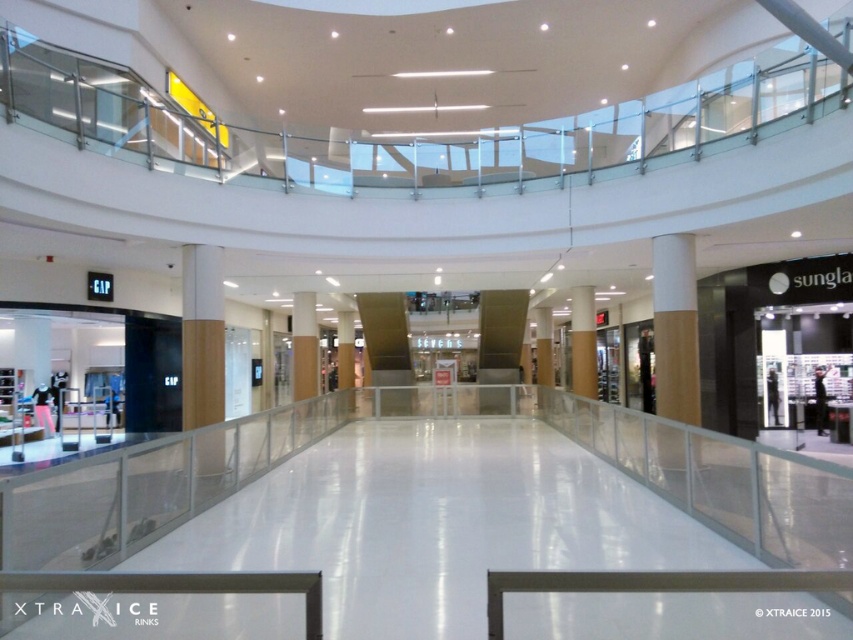
You are an interior designer assessing the mall layout. You notice the brown polished pillar at center and the smooth beige pillar at center. Which pillar would cast a longer shadow during midday if the sun is directly overhead?

The brown polished pillar at center is taller than the smooth beige pillar at center, so it would cast a longer shadow during midday when the sun is directly overhead.

You are a maintenance worker checking the pillars in the mall. You notice two pillars at the center area labeled as wooden pillar at center and brown wood pillar at center. Which one has a larger diameter?

The wooden pillar at center might be wider than brown wood pillar at center, so the wooden pillar at center likely has a larger diameter.

You are standing in the shopping mall and want to locate the brown polished pillar at center and the smooth beige pillar at center. According to the scene, which pillar is positioned to the right of the other?

The brown polished pillar at center is to the right of the smooth beige pillar at center.